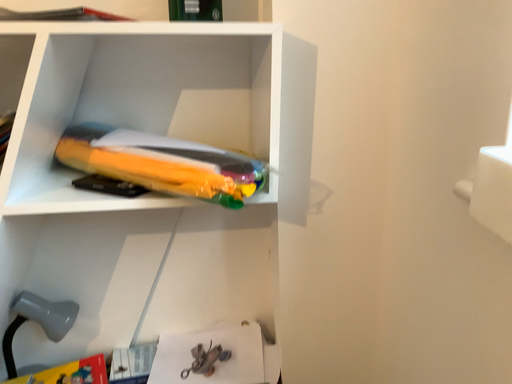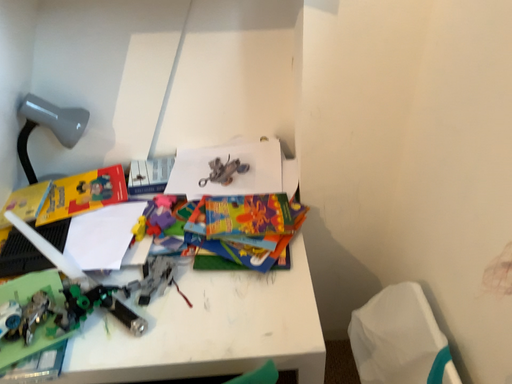
Question: Which way did the camera rotate in the video?

Choices:
 (A) rotated upward
 (B) rotated downward

Answer: (B)